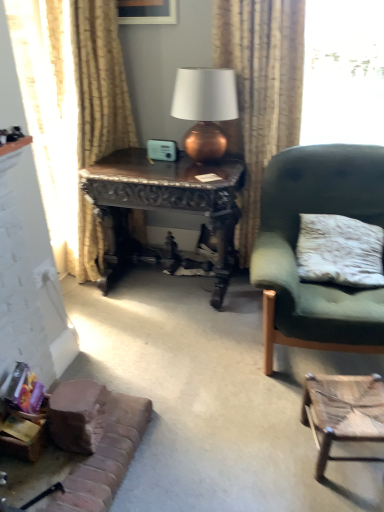
Image resolution: width=384 pixels, height=512 pixels. I want to click on vacant space in front of copper metallic lamp at upper center, so click(x=202, y=173).